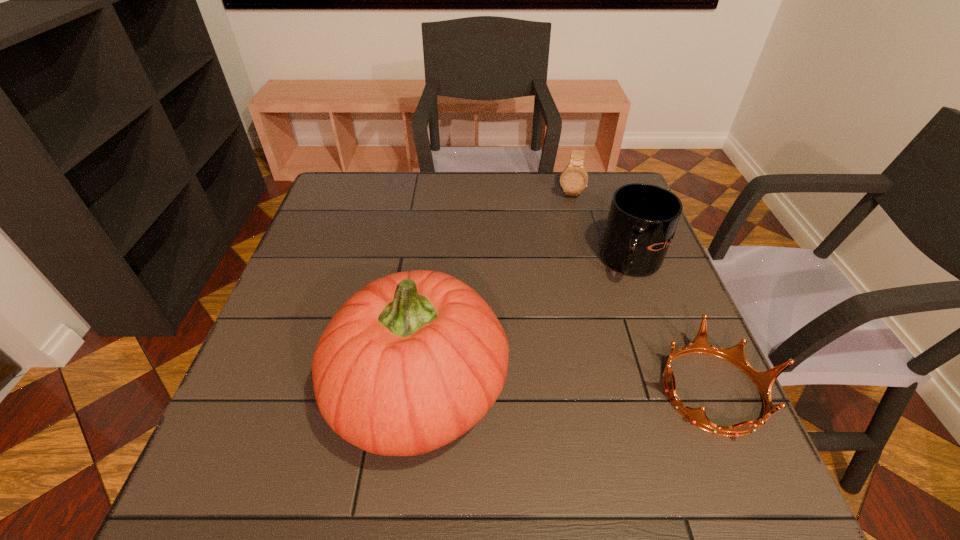
This screenshot has height=540, width=960. I want to click on watch that is at the right edge, so click(574, 178).

The width and height of the screenshot is (960, 540). What are the coordinates of `object present at the far right corner` in the screenshot? It's located at (574, 178).

Image resolution: width=960 pixels, height=540 pixels. Identify the location of object that is at the near right corner. (764, 381).

Find the location of a particular element. free location at the far edge is located at coordinates (501, 207).

This screenshot has height=540, width=960. Identify the location of vacant space at the near edge of the desktop. (570, 415).

The height and width of the screenshot is (540, 960). In the image, there is a desktop. Identify the location of vacant space at the left edge. (330, 265).

You are a GUI agent. You are given a task and a screenshot of the screen. Output one action in this format:
    pyautogui.click(x=<x>, y=<y>)
    Task: Click on the vacant space at the far left corner of the desktop
    The image size is (960, 540).
    Given the screenshot: What is the action you would take?
    pyautogui.click(x=367, y=186)

Image resolution: width=960 pixels, height=540 pixels. What are the coordinates of `vacant area that lies between the second shortest object and the mug` in the screenshot? It's located at (601, 228).

This screenshot has height=540, width=960. In order to click on free space between the shortest object and the third tallest object in this screenshot , I will do `click(641, 292)`.

Image resolution: width=960 pixels, height=540 pixels. What are the coordinates of `vacant area between the farthest object and the crown` in the screenshot? It's located at (641, 292).